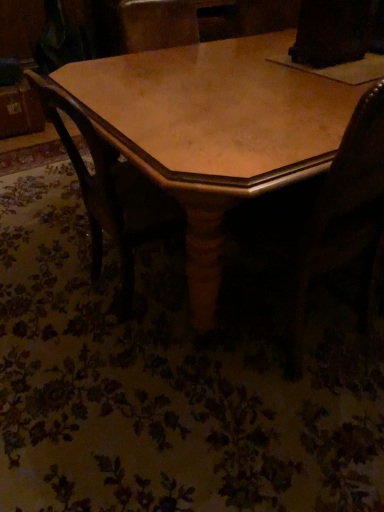
Question: Does wooden table at center contain wooden chair at center?

Choices:
 (A) yes
 (B) no

Answer: (A)

Question: From the image's perspective, is wooden table at center beneath wooden chair at center?

Choices:
 (A) no
 (B) yes

Answer: (A)

Question: Is wooden table at center wider than wooden chair at center?

Choices:
 (A) no
 (B) yes

Answer: (B)

Question: Considering the relative sizes of wooden table at center and wooden chair at center in the image provided, is wooden table at center bigger than wooden chair at center?

Choices:
 (A) no
 (B) yes

Answer: (B)

Question: From a real-world perspective, is wooden table at center physically below wooden chair at center?

Choices:
 (A) yes
 (B) no

Answer: (A)

Question: Does wooden table at center have a lesser width compared to wooden chair at center?

Choices:
 (A) no
 (B) yes

Answer: (A)

Question: Does wooden swivel chair at center contain wooden chair at center?

Choices:
 (A) yes
 (B) no

Answer: (B)

Question: Is wooden swivel chair at center turned away from wooden chair at center?

Choices:
 (A) no
 (B) yes

Answer: (A)

Question: Is wooden swivel chair at center in contact with wooden chair at center?

Choices:
 (A) no
 (B) yes

Answer: (A)

Question: Is wooden swivel chair at center at the right side of wooden chair at center?

Choices:
 (A) yes
 (B) no

Answer: (A)

Question: Does wooden swivel chair at center have a smaller size compared to wooden chair at center?

Choices:
 (A) no
 (B) yes

Answer: (A)

Question: Can you confirm if wooden swivel chair at center is thinner than wooden chair at center?

Choices:
 (A) no
 (B) yes

Answer: (B)

Question: Considering the relative positions of wooden chair at center and wooden swivel chair at center in the image provided, is wooden chair at center to the right of wooden swivel chair at center from the viewer's perspective?

Choices:
 (A) no
 (B) yes

Answer: (A)